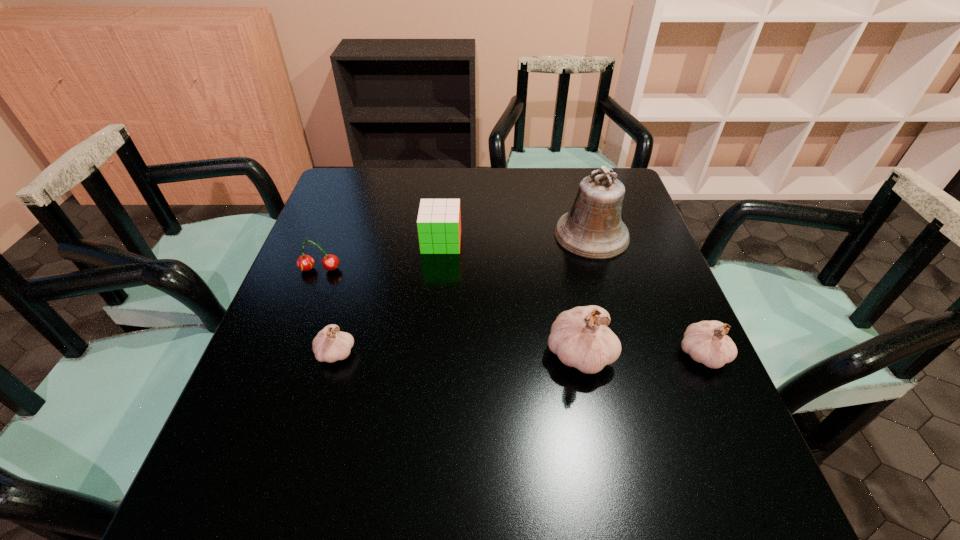
Where is `free space that satisfies the following two spatial constraints: 1. with stems pointing upwards on the leftmost object; 2. on the left side of the tallest garlic`? The image size is (960, 540). free space that satisfies the following two spatial constraints: 1. with stems pointing upwards on the leftmost object; 2. on the left side of the tallest garlic is located at coordinates (288, 354).

Where is `vacant area that satisfies the following two spatial constraints: 1. with stems pointing upwards on the fourth nearest object; 2. on the left side of the tallest garlic`? vacant area that satisfies the following two spatial constraints: 1. with stems pointing upwards on the fourth nearest object; 2. on the left side of the tallest garlic is located at coordinates (288, 354).